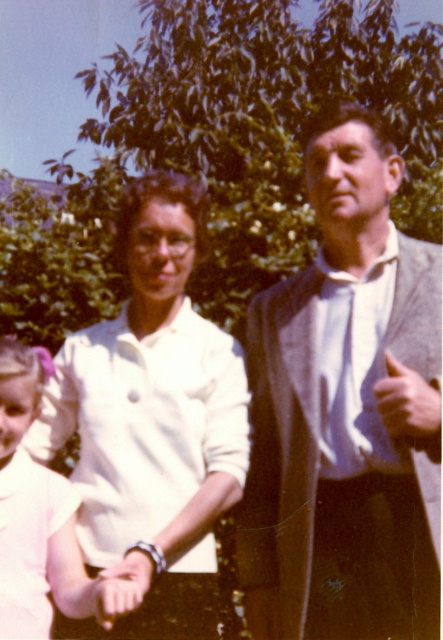
You are a photographer analyzing the composition of this vintage image. You notice a point at coordinates (154, 416). Based on the scene description, can you determine what object this point is located on?

The point at coordinates (154, 416) is located on the white matte shirt at center.